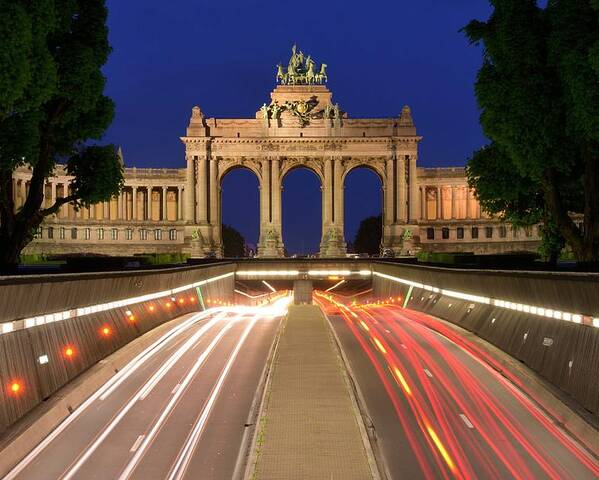
This screenshot has width=599, height=480. Identify the location of running white lights. (559, 314), (523, 309), (144, 296), (93, 310).